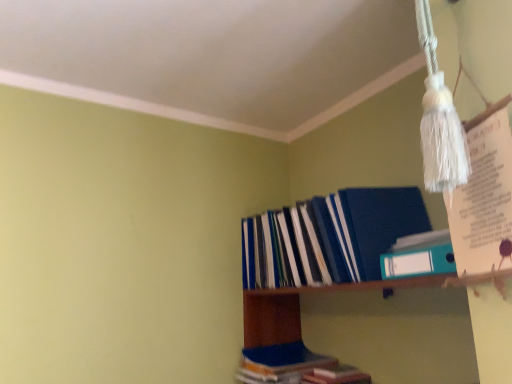
Looking at this image, how much space does blue matte folder at upper right, which ranks as the 2th book in top-to-bottom order, occupy horizontally?

It is 11.15 inches.

From the picture: What is the approximate width of blue hardcover book at lower center, positioned as the first book in bottom-to-top order?

It is 12.84 inches.

Locate an element on the screen. The width and height of the screenshot is (512, 384). blue plastic folder at upper right is located at coordinates (369, 328).

Between point (339, 305) and point (326, 372), which one is positioned behind?

Point (339, 305)

Which of these two, blue plastic folder at upper right or blue hardcover book at lower center, the 3th book from the top, is smaller?

blue hardcover book at lower center, the 3th book from the top.

In the image, is blue plastic folder at upper right positioned in front of or behind blue hardcover book at lower center, the 3th book from the top?

blue plastic folder at upper right is positioned closer to the viewer than blue hardcover book at lower center, the 3th book from the top.

Is blue plastic folder at upper right taller or shorter than blue hardcover book at lower center, positioned as the first book in bottom-to-top order?

Clearly, blue plastic folder at upper right is taller compared to blue hardcover book at lower center, positioned as the first book in bottom-to-top order.

From a real-world perspective, is teal plastic ring binder at upper right, the 1th book from the top, positioned over blue hardcover book at lower center, positioned as the first book in bottom-to-top order, based on gravity?

Yes, from a real-world perspective, teal plastic ring binder at upper right, the 1th book from the top, is above blue hardcover book at lower center, positioned as the first book in bottom-to-top order.

Which is more to the right, teal plastic ring binder at upper right, the third book ordered from the bottom, or blue hardcover book at lower center, the 3th book from the top?

teal plastic ring binder at upper right, the third book ordered from the bottom.

From the image's perspective, does teal plastic ring binder at upper right, the 1th book from the top, appear lower than blue hardcover book at lower center, the 3th book from the top?

Actually, teal plastic ring binder at upper right, the 1th book from the top, appears above blue hardcover book at lower center, the 3th book from the top, in the image.

What's the angular difference between blue plastic folder at upper right and teal plastic ring binder at upper right, the third book ordered from the bottom,'s facing directions?

They differ by 2.43 degrees in their facing directions.

Consider the image. Is blue plastic folder at upper right aimed at teal plastic ring binder at upper right, the third book ordered from the bottom?

No, blue plastic folder at upper right does not turn towards teal plastic ring binder at upper right, the third book ordered from the bottom.

This screenshot has height=384, width=512. I want to click on shelf that appears below the teal plastic ring binder at upper right, the 1th book from the top (from the image's perspective), so click(x=369, y=328).

Consider the image. Is blue plastic folder at upper right at the right side of teal plastic ring binder at upper right, the 1th book from the top?

No, blue plastic folder at upper right is not to the right of teal plastic ring binder at upper right, the 1th book from the top.

Choose the correct answer: Is blue matte folder at upper right, which ranks as the 2th book in top-to-bottom order, inside blue hardcover book at lower center, the 3th book from the top, or outside it?

blue matte folder at upper right, which ranks as the 2th book in top-to-bottom order, is spatially situated outside blue hardcover book at lower center, the 3th book from the top.

From the image's perspective, between blue matte folder at upper right, which ranks as the 2th book in top-to-bottom order, and blue hardcover book at lower center, positioned as the first book in bottom-to-top order, which one is located above?

blue matte folder at upper right, which ranks as the 2th book in top-to-bottom order.

Considering the sizes of blue matte folder at upper right, acting as the second book starting from the bottom, and blue hardcover book at lower center, positioned as the first book in bottom-to-top order, in the image, is blue matte folder at upper right, acting as the second book starting from the bottom, wider or thinner than blue hardcover book at lower center, positioned as the first book in bottom-to-top order,?

Considering their sizes, blue matte folder at upper right, acting as the second book starting from the bottom, looks slimmer than blue hardcover book at lower center, positioned as the first book in bottom-to-top order.

What's the angular difference between blue matte folder at upper right, acting as the second book starting from the bottom, and blue hardcover book at lower center, the 3th book from the top,'s facing directions?

The facing directions of blue matte folder at upper right, acting as the second book starting from the bottom, and blue hardcover book at lower center, the 3th book from the top, are 1.53 degrees apart.

Which point is more forward, (338, 382) or (263, 307)?

Positioned in front is point (338, 382).

In the scene shown: What's the angular difference between blue hardcover book at lower center, positioned as the first book in bottom-to-top order, and blue plastic folder at upper right's facing directions?

The angular difference between blue hardcover book at lower center, positioned as the first book in bottom-to-top order, and blue plastic folder at upper right is 0.893 degrees.

Can you confirm if blue hardcover book at lower center, the 3th book from the top, is wider than blue plastic folder at upper right?

Yes.

Is blue hardcover book at lower center, the 3th book from the top, inside or outside of blue plastic folder at upper right?

blue hardcover book at lower center, the 3th book from the top, is spatially positioned inside blue plastic folder at upper right.

Is teal plastic ring binder at upper right, the 1th book from the top, looking in the opposite direction of blue matte folder at upper right, acting as the second book starting from the bottom?

No.

Which point is more forward, (429, 272) or (314, 237)?

The point (429, 272) is in front.

Can you confirm if teal plastic ring binder at upper right, the third book ordered from the bottom, is shorter than blue matte folder at upper right, which ranks as the 2th book in top-to-bottom order?

Yes.

From the image's perspective, is teal plastic ring binder at upper right, the 1th book from the top, positioned above or below blue matte folder at upper right, acting as the second book starting from the bottom?

Based on their image positions, teal plastic ring binder at upper right, the 1th book from the top, is located above blue matte folder at upper right, acting as the second book starting from the bottom.

From the image's perspective, is teal plastic ring binder at upper right, the third book ordered from the bottom, located above or below blue plastic folder at upper right?

From the image's perspective, teal plastic ring binder at upper right, the third book ordered from the bottom, appears above blue plastic folder at upper right.

Is blue plastic folder at upper right at the back of teal plastic ring binder at upper right, the third book ordered from the bottom?

No, teal plastic ring binder at upper right, the third book ordered from the bottom, is not facing away from blue plastic folder at upper right.

From a real-world perspective, is teal plastic ring binder at upper right, the third book ordered from the bottom, beneath blue plastic folder at upper right?

Actually, teal plastic ring binder at upper right, the third book ordered from the bottom, is physically above blue plastic folder at upper right in the real world.

Does teal plastic ring binder at upper right, the 1th book from the top, have a greater height compared to blue plastic folder at upper right?

No.

I want to click on book lying below the blue plastic folder at upper right (from the image's perspective), so click(294, 367).

The width and height of the screenshot is (512, 384). In order to click on book below the teal plastic ring binder at upper right, the third book ordered from the bottom (from a real-world perspective) in this screenshot , I will do `click(294, 367)`.

When comparing their distances from teal plastic ring binder at upper right, the third book ordered from the bottom, does blue plastic folder at upper right or blue matte folder at upper right, which ranks as the 2th book in top-to-bottom order, seem closer?

blue matte folder at upper right, which ranks as the 2th book in top-to-bottom order.

From the image, which object appears to be nearer to blue hardcover book at lower center, the 3th book from the top, teal plastic ring binder at upper right, the third book ordered from the bottom, or blue plastic folder at upper right?

blue plastic folder at upper right lies closer to blue hardcover book at lower center, the 3th book from the top, than the other object.

Consider the image. Considering their positions, is blue plastic folder at upper right positioned further to teal plastic ring binder at upper right, the third book ordered from the bottom, than blue hardcover book at lower center, positioned as the first book in bottom-to-top order?

Based on the image, blue hardcover book at lower center, positioned as the first book in bottom-to-top order, appears to be further to teal plastic ring binder at upper right, the third book ordered from the bottom.

Estimate the real-world distances between objects in this image. Which object is further from teal plastic ring binder at upper right, the 1th book from the top, blue hardcover book at lower center, the 3th book from the top, or blue plastic folder at upper right?

Among the two, blue hardcover book at lower center, the 3th book from the top, is located further to teal plastic ring binder at upper right, the 1th book from the top.

Based on their spatial positions, is teal plastic ring binder at upper right, the third book ordered from the bottom, or blue plastic folder at upper right further from blue matte folder at upper right, which ranks as the 2th book in top-to-bottom order?

teal plastic ring binder at upper right, the third book ordered from the bottom, lies further to blue matte folder at upper right, which ranks as the 2th book in top-to-bottom order, than the other object.

Considering their positions, is blue hardcover book at lower center, the 3th book from the top, positioned closer to blue plastic folder at upper right than blue matte folder at upper right, acting as the second book starting from the bottom?

blue matte folder at upper right, acting as the second book starting from the bottom.

Estimate the real-world distances between objects in this image. Which object is closer to blue matte folder at upper right, which ranks as the 2th book in top-to-bottom order, teal plastic ring binder at upper right, the third book ordered from the bottom, or blue hardcover book at lower center, positioned as the first book in bottom-to-top order?

teal plastic ring binder at upper right, the third book ordered from the bottom.

Which object lies nearer to the anchor point blue hardcover book at lower center, positioned as the first book in bottom-to-top order, blue plastic folder at upper right or teal plastic ring binder at upper right, the 1th book from the top?

Among the two, blue plastic folder at upper right is located nearer to blue hardcover book at lower center, positioned as the first book in bottom-to-top order.

Identify the location of book between teal plastic ring binder at upper right, the third book ordered from the bottom, and blue hardcover book at lower center, the 3th book from the top, in the vertical direction. (329, 237).

At what (x,y) coordinates should I click in order to perform the action: click on book that lies between teal plastic ring binder at upper right, the 1th book from the top, and blue plastic folder at upper right from top to bottom. Please return your answer as a coordinate pair (x, y). This screenshot has width=512, height=384. Looking at the image, I should click on (329, 237).